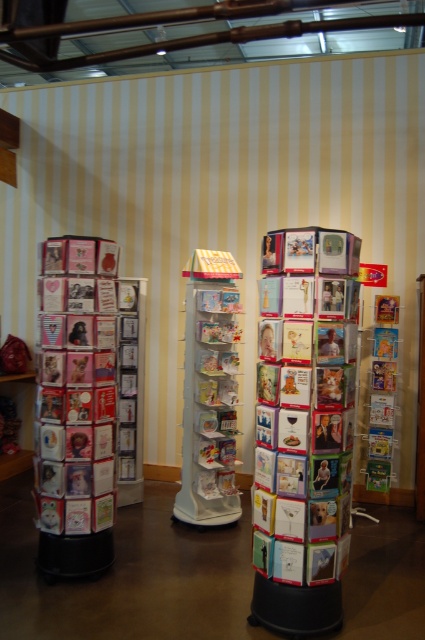
Can you confirm if multicolored paper cards at center is positioned to the left of white glossy greeting cards at center?

Incorrect, multicolored paper cards at center is not on the left side of white glossy greeting cards at center.

Can you confirm if multicolored paper cards at center is smaller than white glossy greeting cards at center?

Indeed, multicolored paper cards at center has a smaller size compared to white glossy greeting cards at center.

You are a GUI agent. You are given a task and a screenshot of the screen. Output one action in this format:
    pyautogui.click(x=<x>, y=<y>)
    Task: Click on the multicolored paper cards at center
    
    Given the screenshot: What is the action you would take?
    pyautogui.click(x=303, y=435)

The height and width of the screenshot is (640, 425). Identify the location of multicolored paper cards at center. (303, 435).